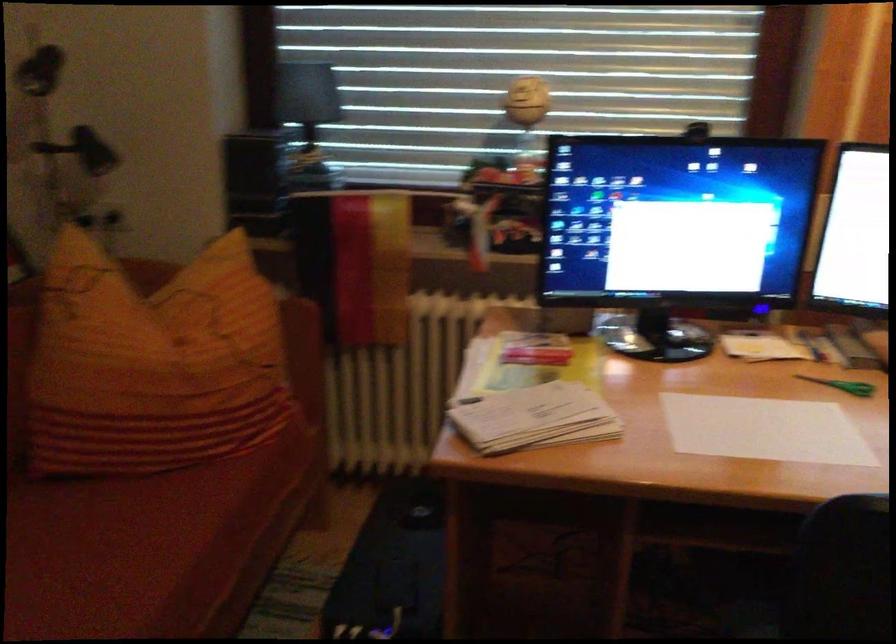
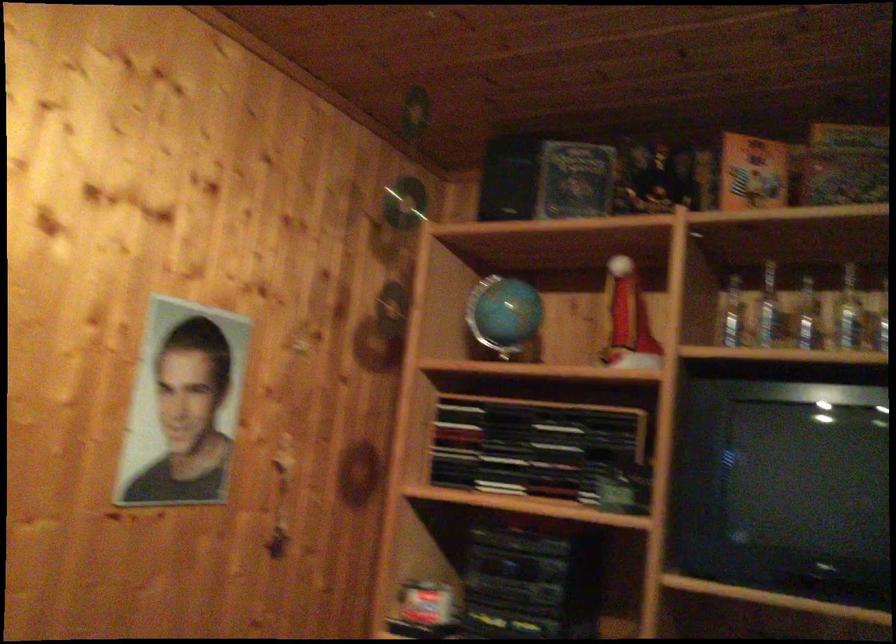
Question: The images are taken continuously from a first-person perspective. In which direction is your viewpoint rotating?

Choices:
 (A) Left
 (B) Right
 (C) Up
 (D) Down

Answer: (B)